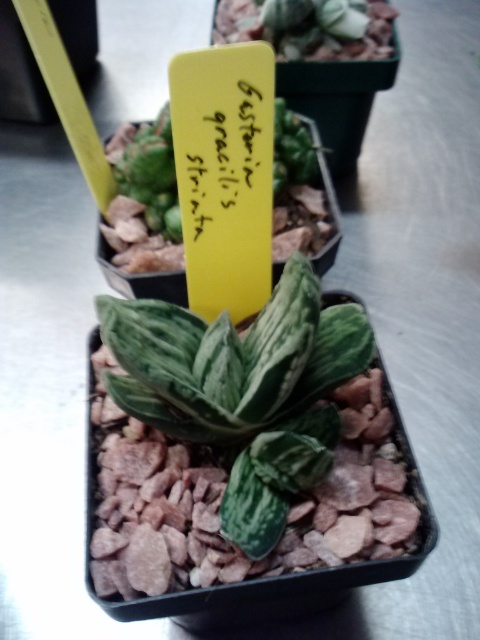
You are a plant enthusiast examining a potted plant with two succulents. You notice the green striped succulent at center and the green textured succulent at center. Which of these two has a smaller width?

The green striped succulent at center is thinner than the green textured succulent at center, so it has a smaller width.

You are a plant enthusiast examining the potted plant. You notice two types of succulents in the pot. Which one is closer to you, the green striped succulent at center or the green textured succulent at center?

The green striped succulent at center is closer to you because it is in front of the green textured succulent at center.